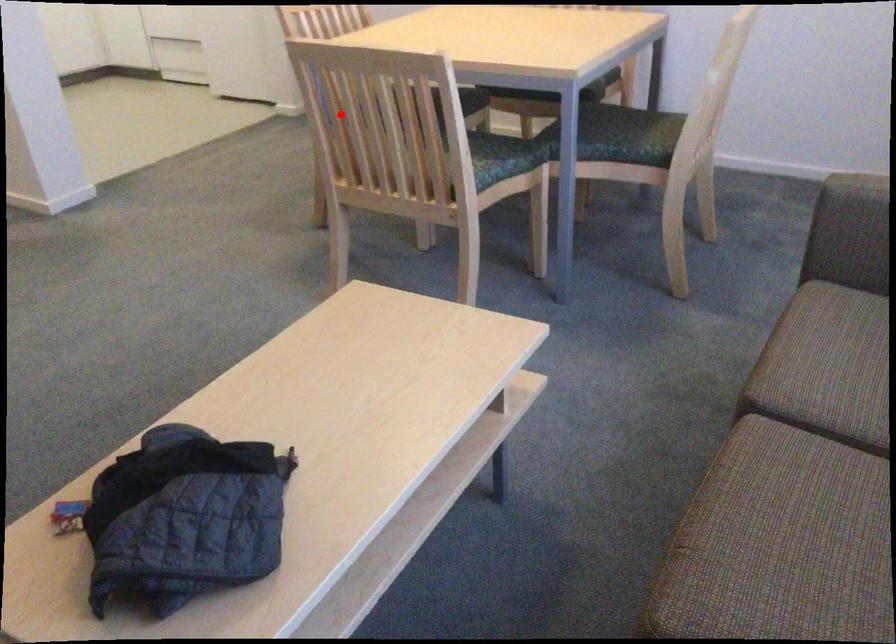
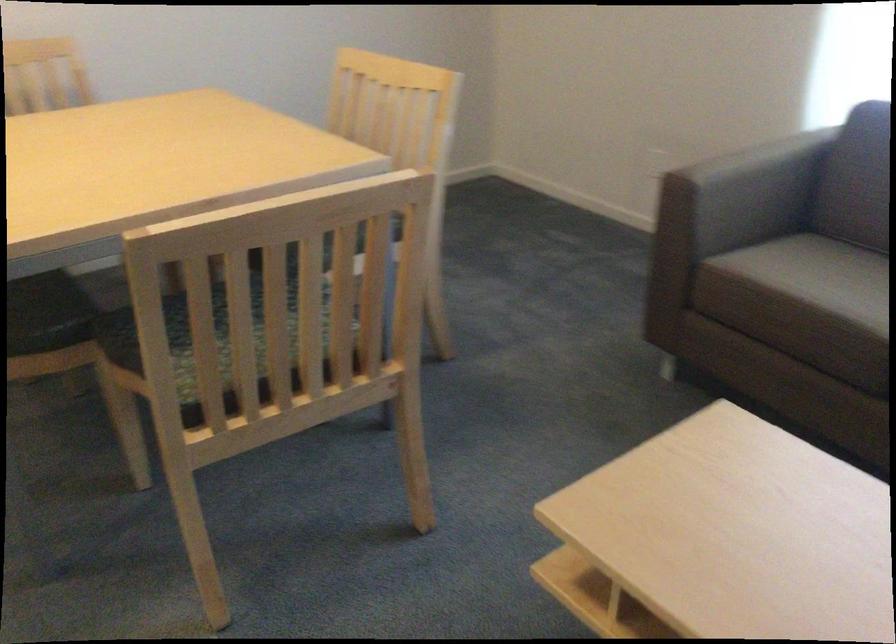
Question: I am providing you with two images of the same scene from different viewpoints. Image1 has a red point marked. In image2, the corresponding 3D location appears at what relative position? Reply with the corresponding letter.

Choices:
 (A) Closer
 (B) Farther

Answer: (A)